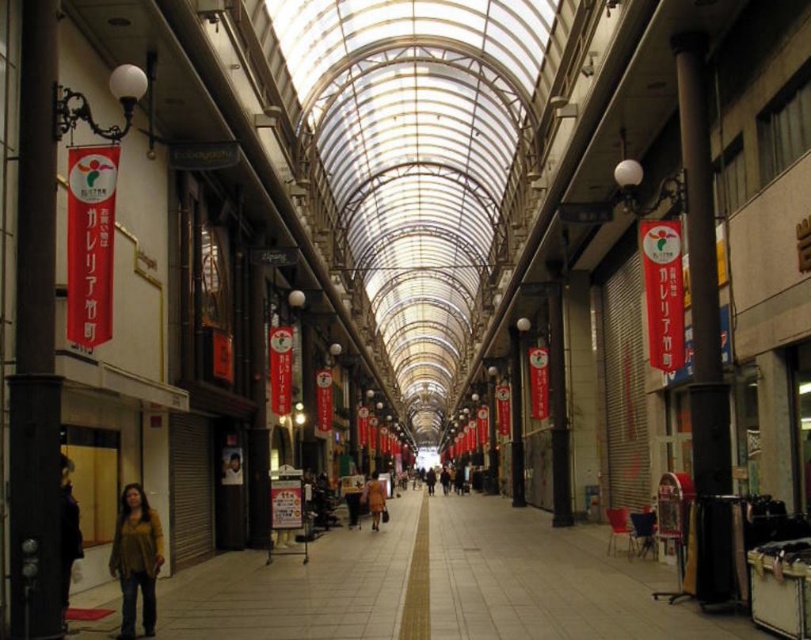
You are a customer who wants to try on the yellow knit sweater at lower left and the dark brown leather jacket at lower left. Since both are hanging on the same hook, which one would you need to remove first to access the other?

The yellow knit sweater at lower left is positioned under the dark brown leather jacket at lower left, so you would need to remove the jacket first to access the sweater.

You are a store owner who wants to display two items, the yellow knit sweater at lower left and the dark brown leather jacket at lower left, on a shelf that can only hold items up to 60 cm in width. Which item can fit on the shelf?

The yellow knit sweater at lower left has a width less than the dark brown leather jacket at lower left, so the yellow knit sweater at lower left can fit on the shelf if its width is under 60 cm. However, without the exact measurement, we cannot confirm. But since it is stated to be less than the jacket, if the jacket exceeds 60 cm, only the sweater might fit. But the problem states the shelf can hold up to 60 cm. Since the sweater is narrower, it can fit as long as its own width is under 60 cm. However, we

You are a customer who wants to examine both the yellow knit sweater at lower left and the dark brown leather jacket at lower left in the shopping arcade. Which item should you approach first to get a closer look?

You should approach the yellow knit sweater at lower left first because it is closer to you than the dark brown leather jacket at lower left.